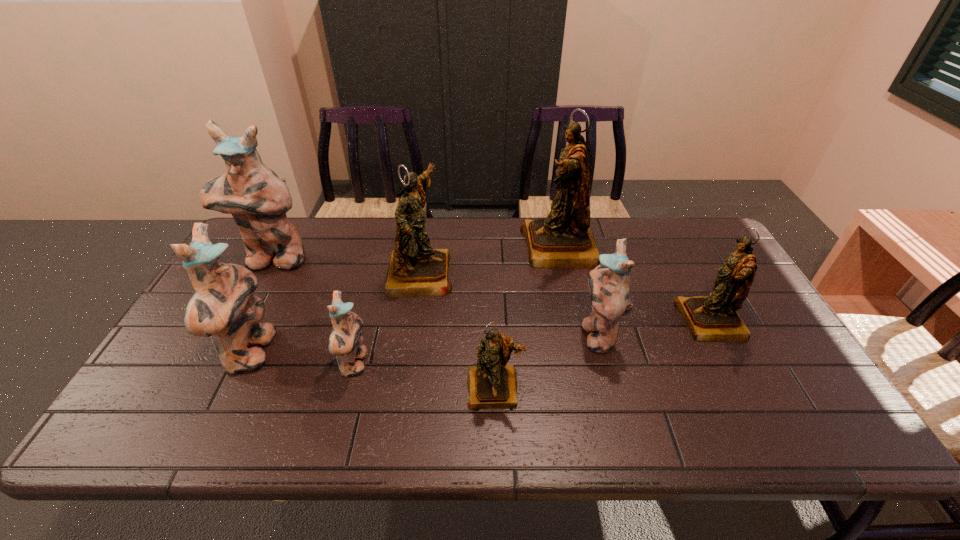
This screenshot has height=540, width=960. I want to click on vacant space that satisfies the following two spatial constraints: 1. on the front-facing side of the third gold figurine from left to right; 2. on the front-facing side of the farthest pink figurine, so click(563, 260).